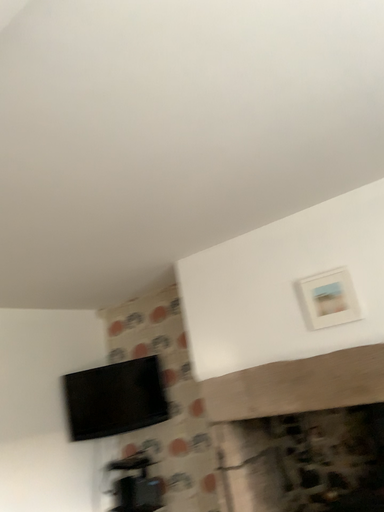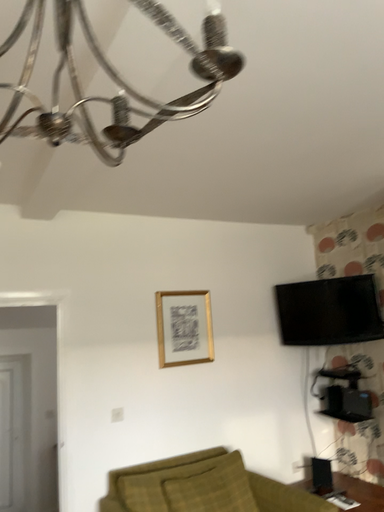
Question: How did the camera likely rotate when shooting the video?

Choices:
 (A) rotated downward
 (B) rotated upward

Answer: (A)